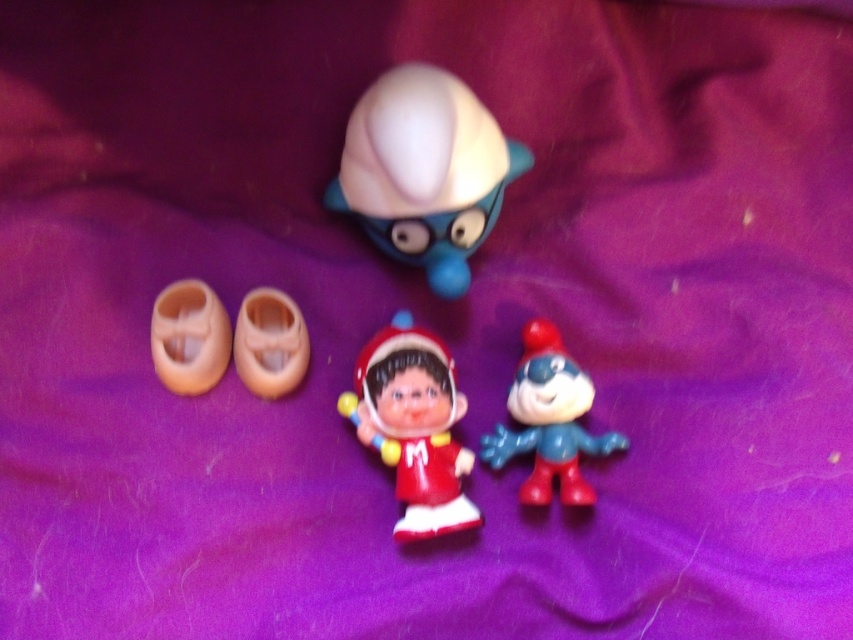
Question: Among these objects, which one is nearest to the camera?

Choices:
 (A) beige rubber shoes at lower left
 (B) matte red plastic figure at center
 (C) smooth plastic toy at center
 (D) matte plastic toy at upper center

Answer: (A)

Question: Which point is farther from the camera taking this photo?

Choices:
 (A) (450, 477)
 (B) (258, 385)
 (C) (219, 317)
 (D) (541, 481)

Answer: (D)

Question: Which of these objects is positioned farthest from the matte plastic toy at upper center?

Choices:
 (A) matte red plastic figure at center
 (B) translucent plastic shoes at center
 (C) beige rubber shoes at lower left
 (D) smooth plastic toy at center

Answer: (C)

Question: Is matte red plastic figure at center below smooth plastic toy at center?

Choices:
 (A) yes
 (B) no

Answer: (A)

Question: Considering the relative positions of matte red plastic figure at center and beige rubber shoes at lower left in the image provided, where is matte red plastic figure at center located with respect to beige rubber shoes at lower left?

Choices:
 (A) left
 (B) right

Answer: (B)

Question: Does smooth plastic toy at center appear over beige rubber shoes at lower left?

Choices:
 (A) no
 (B) yes

Answer: (A)